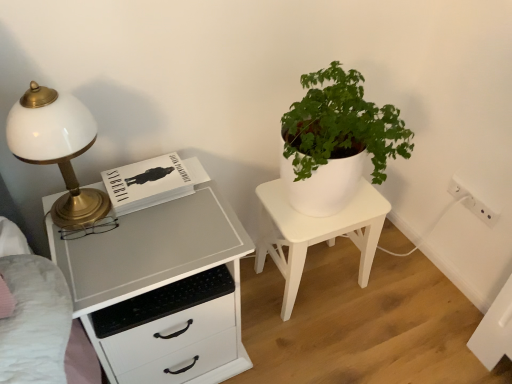
This screenshot has width=512, height=384. Identify the location of vacant area that lies in front of white glossy lamp at left. (94, 260).